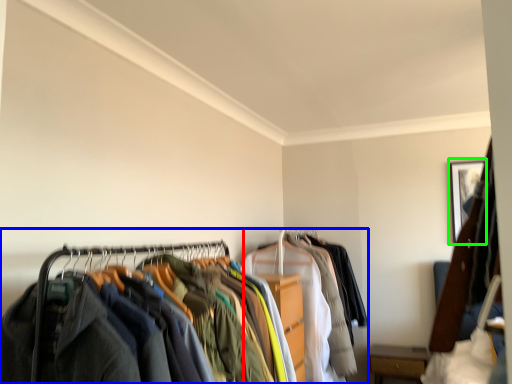
Question: Considering the real-world distances, which object is farthest from garment (highlighted by a red box)? closet (highlighted by a blue box) or picture frame (highlighted by a green box)?

Choices:
 (A) closet
 (B) picture frame

Answer: (B)